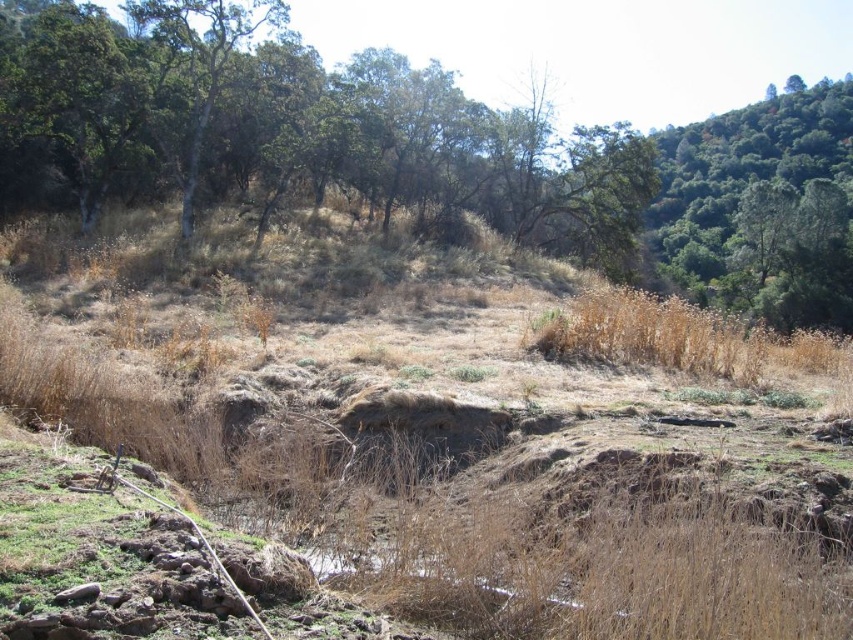
Question: Does brown grassy hillside at center have a larger size compared to green leafy tree at upper right?

Choices:
 (A) yes
 (B) no

Answer: (B)

Question: Which point is closer to the camera?

Choices:
 (A) (19, 362)
 (B) (756, 294)

Answer: (A)

Question: Which object is closer to the camera taking this photo?

Choices:
 (A) green leafy tree at upper right
 (B) brown grassy hillside at center

Answer: (B)

Question: Does brown grassy hillside at center have a lesser width compared to green leafy tree at upper right?

Choices:
 (A) no
 (B) yes

Answer: (B)

Question: Is brown grassy hillside at center further to camera compared to green leafy tree at upper right?

Choices:
 (A) no
 (B) yes

Answer: (A)